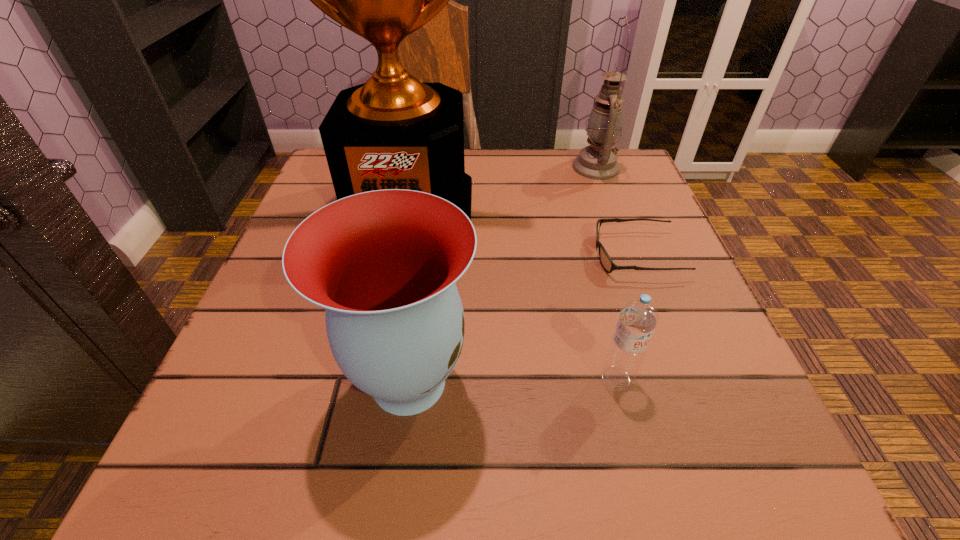
Locate an element on the screen. This screenshot has width=960, height=540. object positioned at the far right corner is located at coordinates (x=598, y=161).

In the image, there is a desktop. Find the location of `vacant region at the far edge`. vacant region at the far edge is located at coordinates (566, 197).

Image resolution: width=960 pixels, height=540 pixels. I want to click on free space at the near edge of the desktop, so click(x=308, y=493).

In the image, there is a desktop. Find the location of `free region at the right edge`. free region at the right edge is located at coordinates click(704, 333).

The width and height of the screenshot is (960, 540). Identify the location of vacant region at the far left corner of the desktop. (318, 177).

Locate an element on the screen. The height and width of the screenshot is (540, 960). vacant space at the far right corner of the desktop is located at coordinates (575, 152).

The image size is (960, 540). In order to click on vacant space at the near right corner of the desktop in this screenshot , I will do `click(709, 433)`.

What are the coordinates of `free spot between the trophy cup and the second tallest object` in the screenshot? It's located at (502, 185).

Image resolution: width=960 pixels, height=540 pixels. Find the location of `vacant point located between the shortest object and the oil lamp`. vacant point located between the shortest object and the oil lamp is located at coordinates (616, 211).

This screenshot has width=960, height=540. In order to click on free point between the tallest object and the water bottle in this screenshot , I will do `click(512, 291)`.